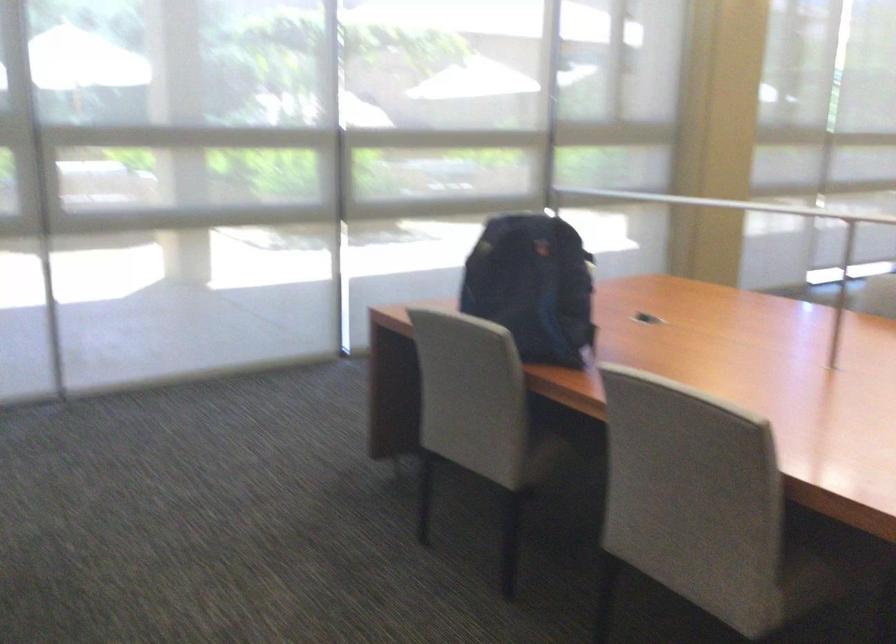
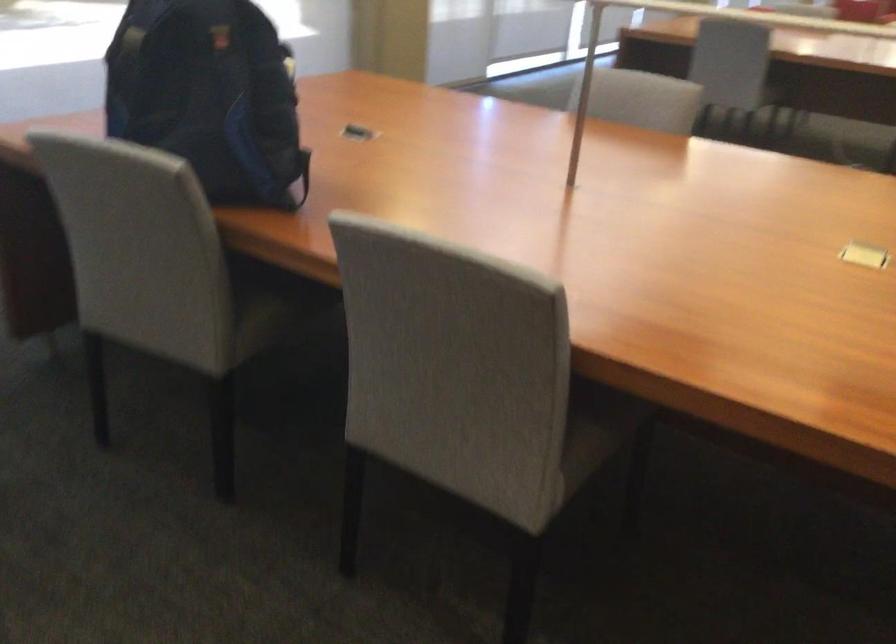
Question: The camera is either moving clockwise (left) or counter-clockwise (right) around the object. The first image is from the beginning of the video and the second image is from the end. Is the camera moving left or right when shooting the video?

Choices:
 (A) Left
 (B) Right

Answer: (A)